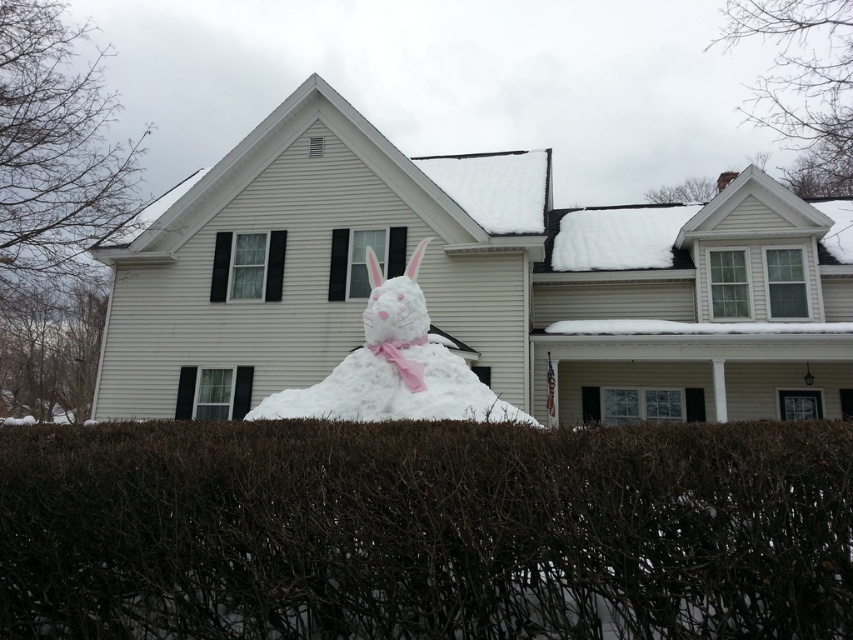
Does brown textured hedge at lower center have a lesser width compared to white fluffy snowman at center?

In fact, brown textured hedge at lower center might be wider than white fluffy snowman at center.

Is point (306, 486) farther from camera compared to point (392, 336)?

No, (306, 486) is in front of (392, 336).

Is point (490, 545) closer to viewer compared to point (422, 312)?

Yes, point (490, 545) is in front of point (422, 312).

Where is `brown textured hedge at lower center`? This screenshot has width=853, height=640. brown textured hedge at lower center is located at coordinates (425, 531).